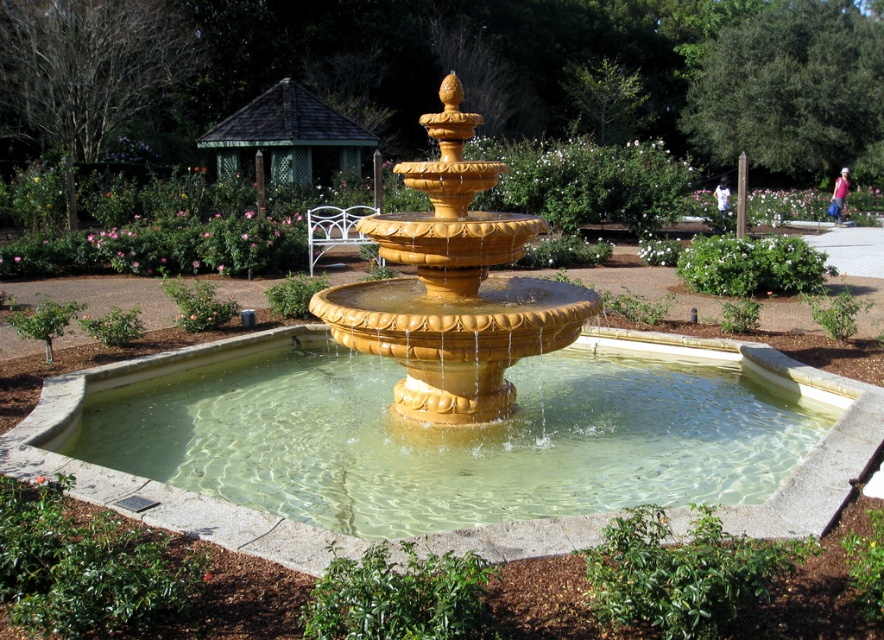
The width and height of the screenshot is (884, 640). What do you see at coordinates (453, 288) in the screenshot? I see `golden polished stone fountain at center` at bounding box center [453, 288].

The width and height of the screenshot is (884, 640). What are the coordinates of `golden polished stone fountain at center` in the screenshot? It's located at (453, 288).

Is point (615, 356) positioned after point (442, 97)?

That is True.

Does clear stone pool at center have a lesser height compared to golden polished stone fountain at center?

Yes.

Where is `clear stone pool at center`? clear stone pool at center is located at coordinates (450, 444).

From the picture: Who is more distant from viewer, (189, 365) or (319, 141)?

Positioned behind is point (319, 141).

Who is higher up, clear stone pool at center or green wooden gazebo at upper center?

green wooden gazebo at upper center

The width and height of the screenshot is (884, 640). Describe the element at coordinates (450, 444) in the screenshot. I see `clear stone pool at center` at that location.

I want to click on clear stone pool at center, so click(x=450, y=444).